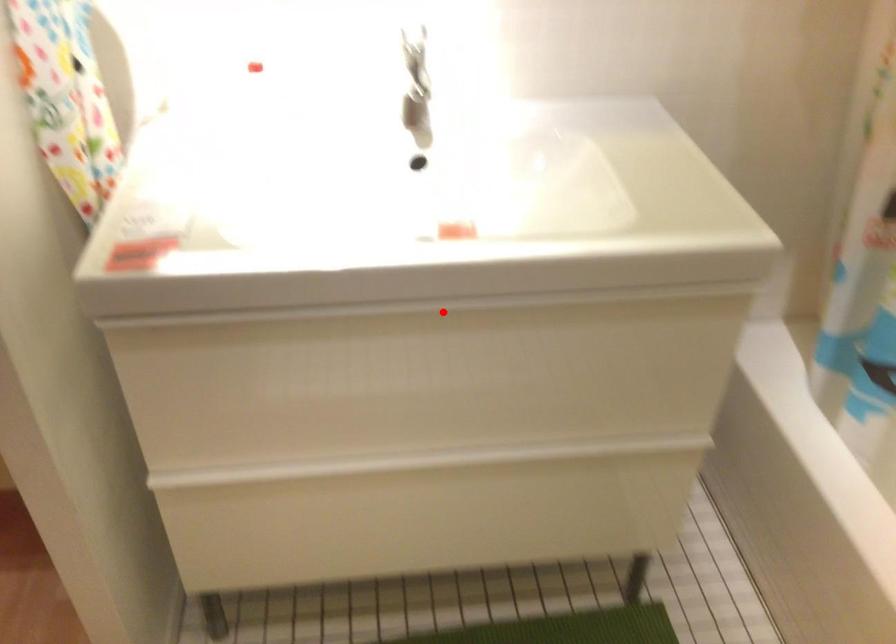
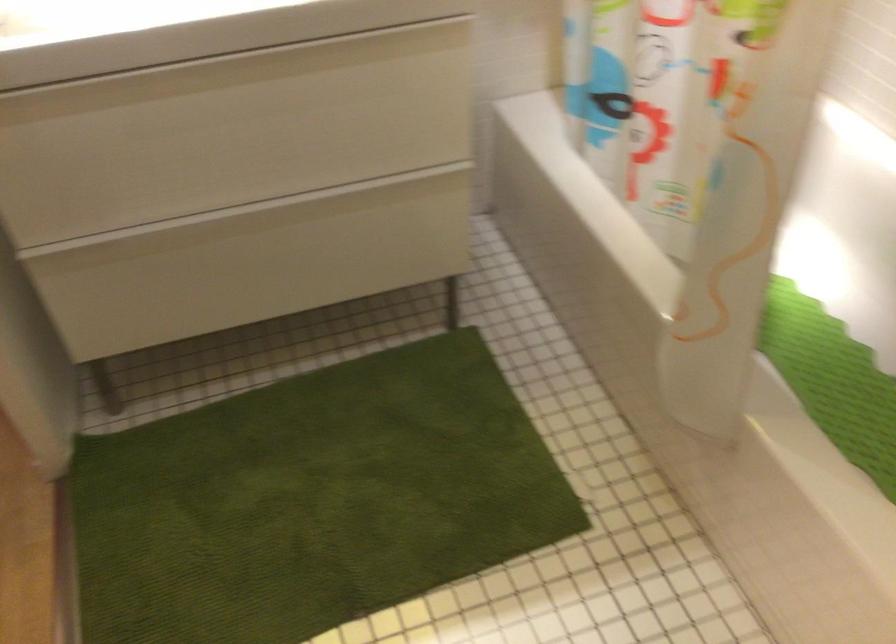
Locate, in the second image, the point that corresponds to the highlighted location in the first image.

(228, 70)